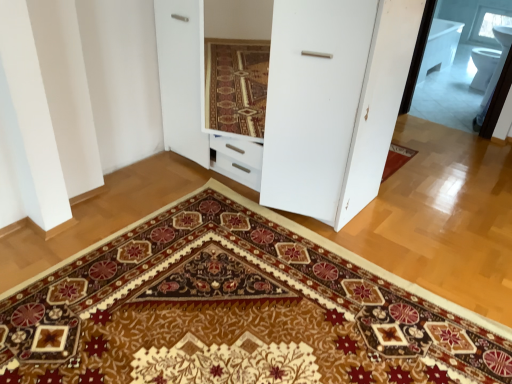
Question: Considering the relative positions of transparent glass window at upper right and white glossy dresser at center in the image provided, is transparent glass window at upper right behind white glossy dresser at center?

Choices:
 (A) yes
 (B) no

Answer: (A)

Question: Is transparent glass window at upper right at the right side of white glossy dresser at center?

Choices:
 (A) no
 (B) yes

Answer: (B)

Question: Does transparent glass window at upper right come in front of white glossy dresser at center?

Choices:
 (A) yes
 (B) no

Answer: (B)

Question: Is transparent glass window at upper right beside white glossy dresser at center?

Choices:
 (A) yes
 (B) no

Answer: (B)

Question: Considering the relative sizes of transparent glass window at upper right and white glossy dresser at center in the image provided, is transparent glass window at upper right thinner than white glossy dresser at center?

Choices:
 (A) yes
 (B) no

Answer: (A)

Question: From the image's perspective, would you say transparent glass window at upper right is positioned over white glossy dresser at center?

Choices:
 (A) yes
 (B) no

Answer: (A)

Question: Is white glossy dresser at center next to transparent glass window at upper right and touching it?

Choices:
 (A) no
 (B) yes

Answer: (A)

Question: Is white glossy dresser at center not within transparent glass window at upper right?

Choices:
 (A) yes
 (B) no

Answer: (A)

Question: Can you confirm if white glossy dresser at center is thinner than transparent glass window at upper right?

Choices:
 (A) no
 (B) yes

Answer: (A)

Question: Could you tell me if white glossy dresser at center is facing transparent glass window at upper right?

Choices:
 (A) no
 (B) yes

Answer: (A)

Question: From a real-world perspective, does white glossy dresser at center stand above transparent glass window at upper right?

Choices:
 (A) yes
 (B) no

Answer: (A)

Question: Is white glossy dresser at center in front of transparent glass window at upper right?

Choices:
 (A) yes
 (B) no

Answer: (A)

Question: Considering the relative positions of carpeted mat at center and white glossy dresser at center in the image provided, is carpeted mat at center to the left of white glossy dresser at center from the viewer's perspective?

Choices:
 (A) no
 (B) yes

Answer: (B)